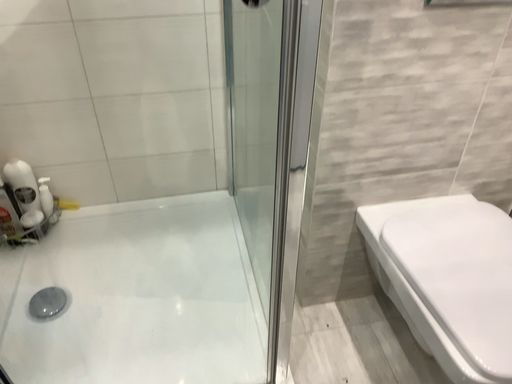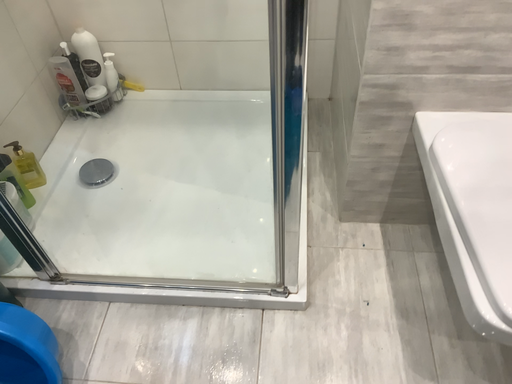
Question: How did the camera likely rotate when shooting the video?

Choices:
 (A) rotated downward
 (B) rotated upward

Answer: (A)